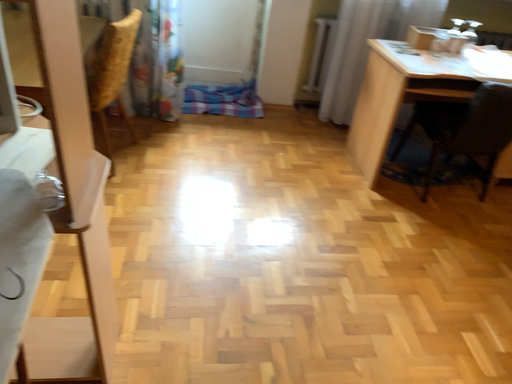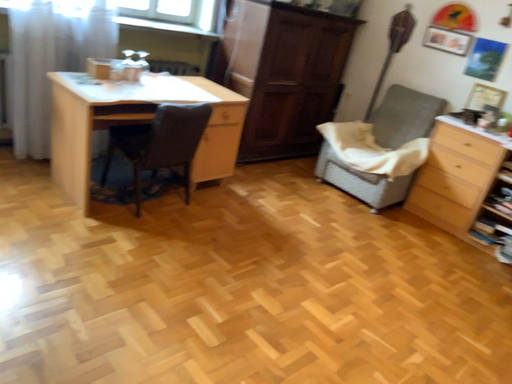
Question: Which way did the camera rotate in the video?

Choices:
 (A) rotated left
 (B) rotated right

Answer: (B)